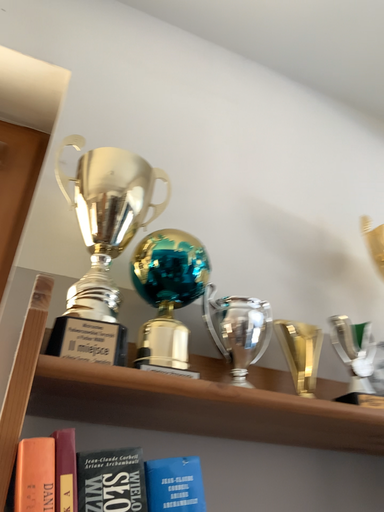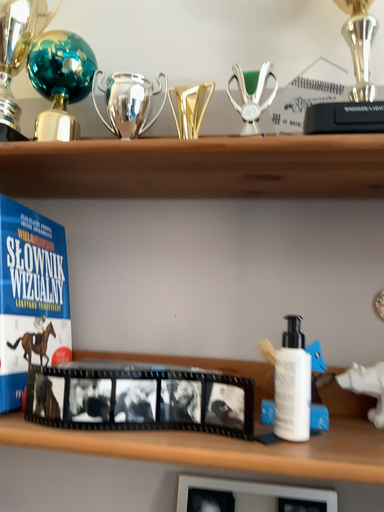
Question: Which way did the camera rotate in the video?

Choices:
 (A) rotated right
 (B) rotated left

Answer: (B)